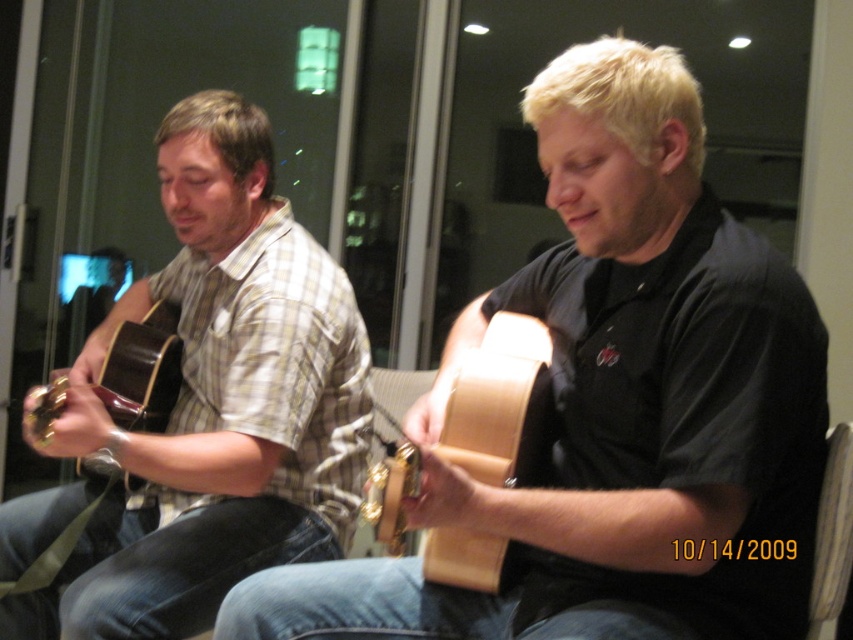
Is matte wood guitar at center closer to the viewer compared to natural wood acoustic guitar at center?

That is True.

Does point (746, 269) come in front of point (486, 422)?

Yes, point (746, 269) is closer to viewer.

Identify the location of matte wood guitar at center. The height and width of the screenshot is (640, 853). pyautogui.click(x=616, y=404).

This screenshot has width=853, height=640. I want to click on matte wood guitar at center, so click(616, 404).

Is natural wood acoustic guitar at center in front of brown leather armchair at lower right?

Yes, natural wood acoustic guitar at center is closer to the viewer.

Which is in front, point (512, 561) or point (814, 550)?

Point (814, 550) is in front.

Who is more distant from viewer, (515, 320) or (833, 515)?

Positioned behind is point (515, 320).

Where is `natural wood acoustic guitar at center`? natural wood acoustic guitar at center is located at coordinates (502, 404).

Can you confirm if matte brown guitar at left is positioned to the left of brown leather armchair at lower right?

Correct, you'll find matte brown guitar at left to the left of brown leather armchair at lower right.

Is matte brown guitar at left smaller than brown leather armchair at lower right?

Incorrect, matte brown guitar at left is not smaller in size than brown leather armchair at lower right.

Between point (178, 534) and point (838, 451), which one is positioned behind?

The point (178, 534) is behind.

Locate an element on the screen. Image resolution: width=853 pixels, height=640 pixels. matte brown guitar at left is located at coordinates (215, 403).